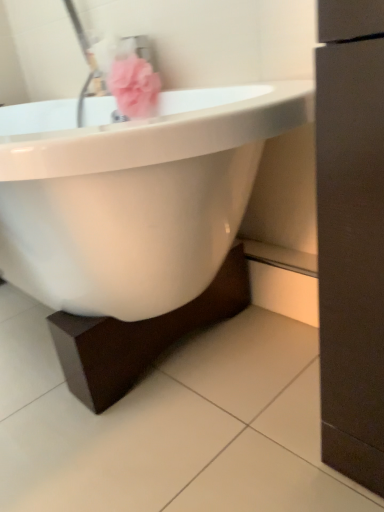
Image resolution: width=384 pixels, height=512 pixels. In order to click on pink fabric flower at upper center in this screenshot , I will do `click(134, 87)`.

The width and height of the screenshot is (384, 512). Describe the element at coordinates (134, 87) in the screenshot. I see `pink fabric flower at upper center` at that location.

You are a GUI agent. You are given a task and a screenshot of the screen. Output one action in this format:
    pyautogui.click(x=<x>, y=<y>)
    Task: Click on the pink fabric flower at upper center
    Image resolution: width=384 pixels, height=512 pixels.
    Given the screenshot: What is the action you would take?
    pyautogui.click(x=134, y=87)